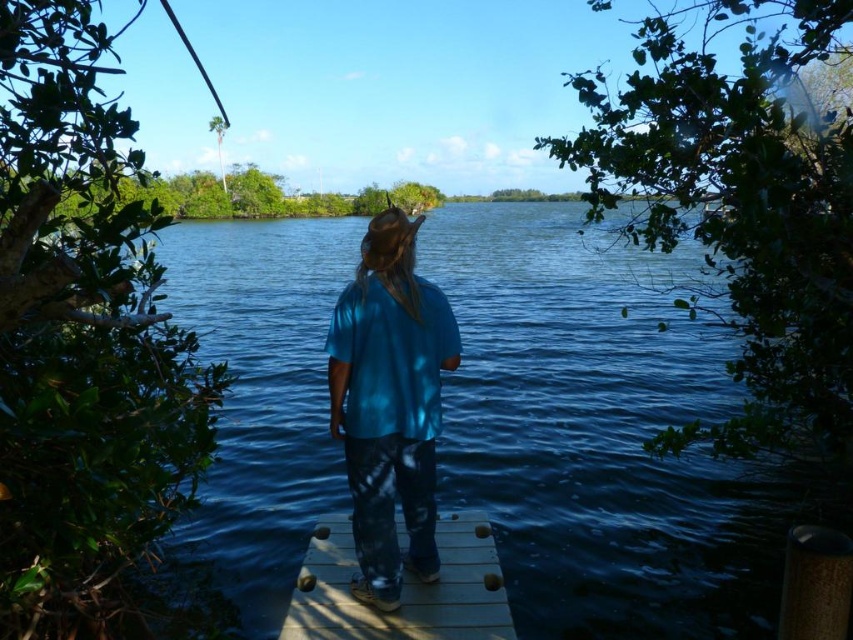
Question: Among these objects, which one is farthest from the camera?

Choices:
 (A) wooden at center
 (B) blue cotton shirt at center
 (C) blue water at center

Answer: (C)

Question: Is blue water at center bigger than blue cotton shirt at center?

Choices:
 (A) yes
 (B) no

Answer: (A)

Question: Considering the relative positions of blue water at center and blue cotton shirt at center in the image provided, where is blue water at center located with respect to blue cotton shirt at center?

Choices:
 (A) below
 (B) above

Answer: (B)

Question: Is blue water at center further to the viewer compared to blue cotton shirt at center?

Choices:
 (A) no
 (B) yes

Answer: (B)

Question: Which object is closer to the camera taking this photo?

Choices:
 (A) wooden at center
 (B) blue cotton shirt at center
 (C) blue water at center

Answer: (B)

Question: Which of these objects is positioned farthest from the wooden at center?

Choices:
 (A) blue cotton shirt at center
 (B) blue water at center

Answer: (B)